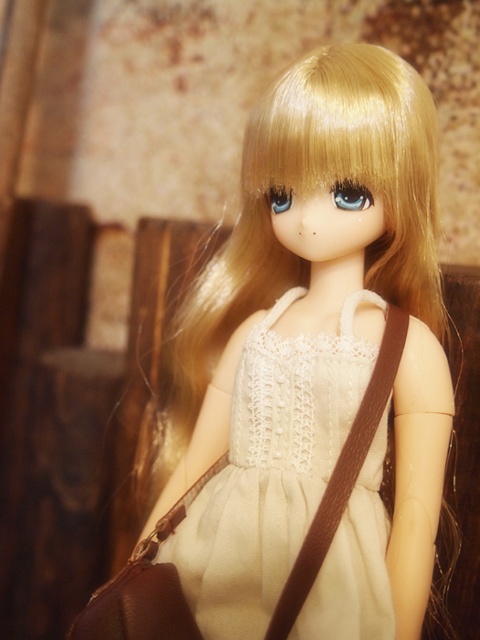
Can you confirm if white lace dress at center is positioned below brown leather bag at center?

No, white lace dress at center is not below brown leather bag at center.

Can you confirm if white lace dress at center is taller than brown leather bag at center?

Yes.

The width and height of the screenshot is (480, 640). In order to click on white lace dress at center in this screenshot , I will do `click(271, 470)`.

At what (x,y) coordinates should I click in order to perform the action: click on white lace dress at center. Please return your answer as a coordinate pair (x, y). This screenshot has width=480, height=640. Looking at the image, I should click on (271, 470).

Does matte white dress at center appear on the right side of brown leather bag at center?

Correct, you'll find matte white dress at center to the right of brown leather bag at center.

Based on the photo, which is above, matte white dress at center or brown leather bag at center?

matte white dress at center is higher up.

Between point (407, 449) and point (175, 620), which one is positioned behind?

The point (407, 449) is more distant.

This screenshot has height=640, width=480. Identify the location of matte white dress at center. (315, 358).

Can you confirm if matte white dress at center is bigger than white lace dress at center?

Correct, matte white dress at center is larger in size than white lace dress at center.

Which is more to the left, matte white dress at center or white lace dress at center?

From the viewer's perspective, matte white dress at center appears more on the left side.

Does point (409, 436) come in front of point (327, 419)?

Yes, point (409, 436) is closer to viewer.

Image resolution: width=480 pixels, height=640 pixels. In order to click on matte white dress at center in this screenshot , I will do `click(315, 358)`.